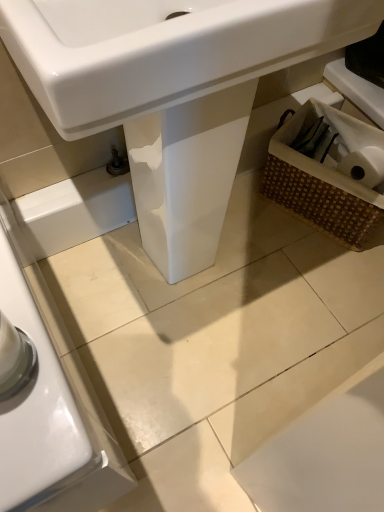
Question: Is white glossy sink at center closer to camera compared to woven brown basket at lower right?

Choices:
 (A) no
 (B) yes

Answer: (B)

Question: Is woven brown basket at lower right at the back of white glossy sink at center?

Choices:
 (A) yes
 (B) no

Answer: (B)

Question: From a real-world perspective, is white glossy sink at center physically above woven brown basket at lower right?

Choices:
 (A) yes
 (B) no

Answer: (A)

Question: From the image's perspective, is white glossy sink at center located beneath woven brown basket at lower right?

Choices:
 (A) no
 (B) yes

Answer: (B)

Question: From a real-world perspective, does white glossy sink at center sit lower than woven brown basket at lower right?

Choices:
 (A) no
 (B) yes

Answer: (A)

Question: Relative to white glossy sink at center, is woven brown basket at lower right in front or behind?

Choices:
 (A) behind
 (B) front

Answer: (A)

Question: From a real-world perspective, is woven brown basket at lower right positioned above or below white glossy sink at center?

Choices:
 (A) above
 (B) below

Answer: (B)

Question: Is woven brown basket at lower right taller or shorter than white glossy sink at center?

Choices:
 (A) tall
 (B) short

Answer: (B)

Question: Would you say woven brown basket at lower right is inside or outside white glossy sink at center?

Choices:
 (A) inside
 (B) outside

Answer: (B)

Question: Is woven brown basket at lower right bigger or smaller than woven brown basket at lower right?

Choices:
 (A) big
 (B) small

Answer: (B)

Question: Is woven brown basket at lower right inside or outside of woven brown basket at lower right?

Choices:
 (A) inside
 (B) outside

Answer: (A)

Question: Considering the positions of woven brown basket at lower right and woven brown basket at lower right in the image, is woven brown basket at lower right taller or shorter than woven brown basket at lower right?

Choices:
 (A) short
 (B) tall

Answer: (A)

Question: Considering the positions of point (327, 118) and point (331, 174), is point (327, 118) closer or farther from the camera than point (331, 174)?

Choices:
 (A) closer
 (B) farther

Answer: (B)

Question: Considering the positions of white glossy sink at center and woven brown basket at lower right in the image, is white glossy sink at center taller or shorter than woven brown basket at lower right?

Choices:
 (A) tall
 (B) short

Answer: (A)

Question: Choose the correct answer: Is white glossy sink at center inside woven brown basket at lower right or outside it?

Choices:
 (A) outside
 (B) inside

Answer: (A)